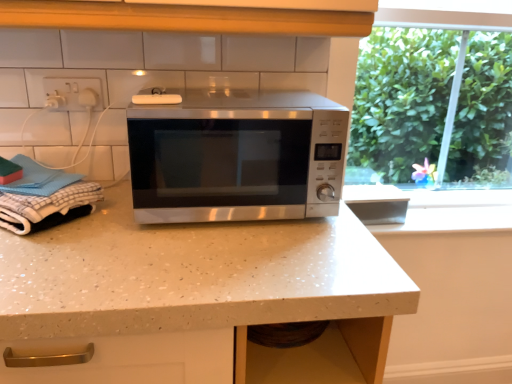
Identify the location of spots to the right of white checkered cloth at left. This screenshot has width=512, height=384. (136, 231).